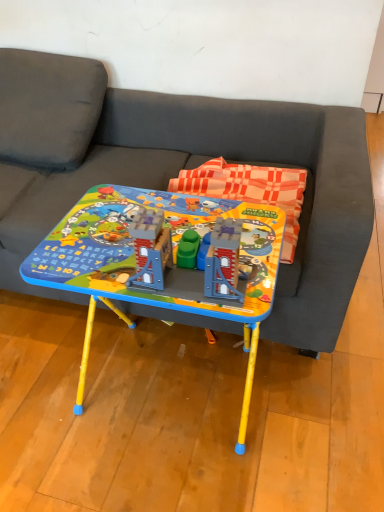
Question: From their relative heights in the image, would you say matte plastic table at center is taller or shorter than dark gray fabric couch at center?

Choices:
 (A) short
 (B) tall

Answer: (A)

Question: Is matte plastic table at center to the left or to the right of dark gray fabric couch at center in the image?

Choices:
 (A) left
 (B) right

Answer: (B)

Question: Looking at the image, does matte plastic table at center seem bigger or smaller compared to dark gray fabric couch at center?

Choices:
 (A) big
 (B) small

Answer: (B)

Question: In the image, is dark gray fabric couch at center positioned in front of or behind matte plastic table at center?

Choices:
 (A) front
 (B) behind

Answer: (B)

Question: Considering the relative positions of dark gray fabric couch at center and matte plastic table at center in the image provided, is dark gray fabric couch at center to the left or to the right of matte plastic table at center?

Choices:
 (A) right
 (B) left

Answer: (B)

Question: Is dark gray fabric couch at center bigger or smaller than matte plastic table at center?

Choices:
 (A) small
 (B) big

Answer: (B)

Question: From a real-world perspective, is dark gray fabric couch at center physically located above or below matte plastic table at center?

Choices:
 (A) above
 (B) below

Answer: (A)